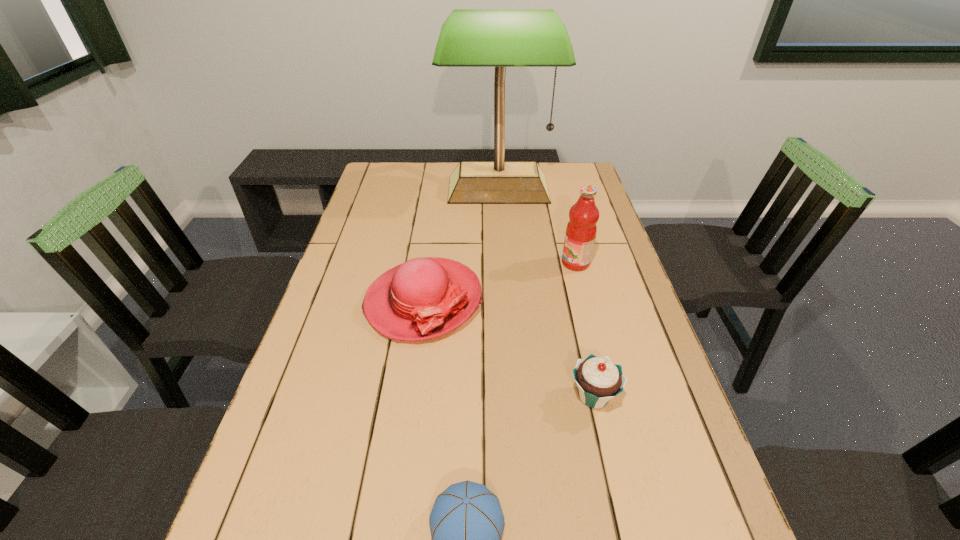
Find the location of a particular element. free space located 0.110m on the right of the second nearest object is located at coordinates pos(669,396).

Identify the location of object located in the far edge section of the desktop. Image resolution: width=960 pixels, height=540 pixels. (500, 38).

Find the location of `object located in the left edge section of the desktop`. object located in the left edge section of the desktop is located at coordinates (423, 298).

At what (x,y) coordinates should I click in order to perform the action: click on table lamp that is at the right edge. Please return your answer as a coordinate pair (x, y). The height and width of the screenshot is (540, 960). Looking at the image, I should click on (500, 38).

Where is `fruit juice present at the right edge`? fruit juice present at the right edge is located at coordinates (581, 230).

I want to click on cupcake present at the right edge, so click(599, 380).

Where is `object positioned at the far right corner`? Image resolution: width=960 pixels, height=540 pixels. object positioned at the far right corner is located at coordinates (500, 38).

In the image, there is a desktop. Where is `free space at the left edge`? This screenshot has height=540, width=960. free space at the left edge is located at coordinates (379, 232).

Locate an element on the screen. This screenshot has height=540, width=960. free space at the right edge of the desktop is located at coordinates (631, 295).

Where is `free space that is in between the cupcake and the fruit juice`? The width and height of the screenshot is (960, 540). free space that is in between the cupcake and the fruit juice is located at coordinates (585, 329).